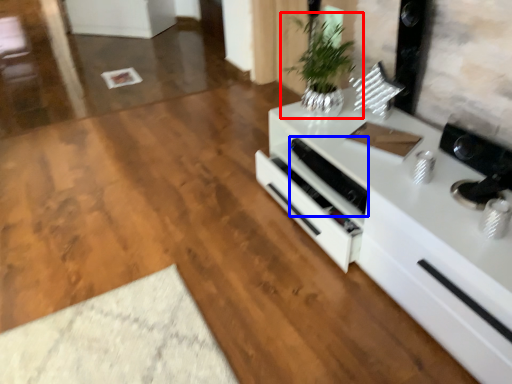
Question: Which point is further to the camera, houseplant (highlighted by a red box) or appliance (highlighted by a blue box)?

Choices:
 (A) houseplant
 (B) appliance

Answer: (B)